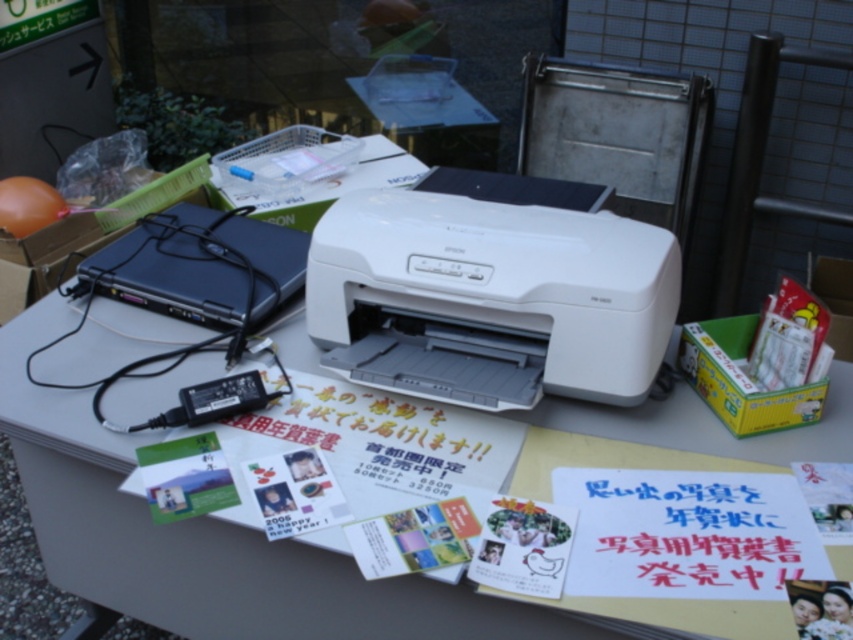
Question: In this image, where is white plastic printer at center located relative to green matte postcard at center?

Choices:
 (A) below
 (B) above

Answer: (B)

Question: Which object is positioned farthest from the matte paper postcard at center?

Choices:
 (A) green matte postcard at center
 (B) white plastic printer at center

Answer: (A)

Question: Can you confirm if white plastic printer at center is positioned above green matte postcard at center?

Choices:
 (A) no
 (B) yes

Answer: (B)

Question: Which point is farther from the camera taking this photo?

Choices:
 (A) (254, 324)
 (B) (206, 499)

Answer: (A)

Question: Is black plastic laptop at left smaller than matte paper postcard at center?

Choices:
 (A) no
 (B) yes

Answer: (A)

Question: Which point is closer to the camera?

Choices:
 (A) (234, 308)
 (B) (236, 496)
 (C) (541, 532)

Answer: (C)